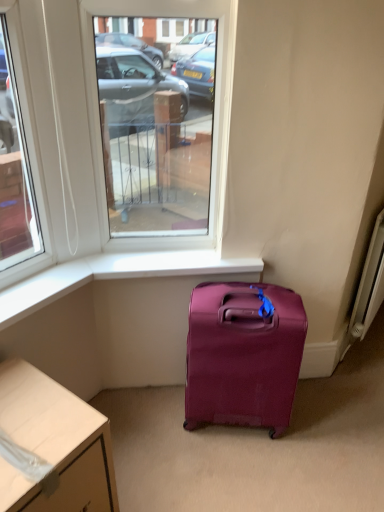
Question: Looking at the image, does matte purple suitcase at lower center seem bigger or smaller compared to white glossy desk at lower left?

Choices:
 (A) small
 (B) big

Answer: (A)

Question: From the image's perspective, is matte purple suitcase at lower center above or below white glossy desk at lower left?

Choices:
 (A) above
 (B) below

Answer: (A)

Question: Considering the real-world distances, which object is farthest from the white metallic radiator at right?

Choices:
 (A) white glossy desk at lower left
 (B) matte purple suitcase at lower center
 (C) white smooth window sill at lower center
 (D) clear glass window at center

Answer: (A)

Question: Based on their relative distances, which object is nearer to the matte purple suitcase at lower center?

Choices:
 (A) white smooth window sill at lower center
 (B) clear glass window at center
 (C) white metallic radiator at right
 (D) white glossy desk at lower left

Answer: (A)